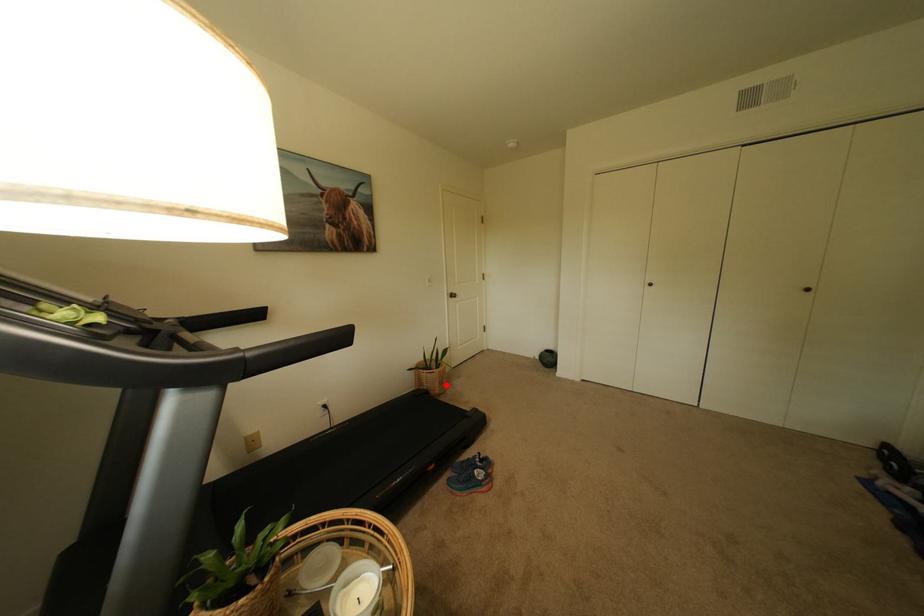
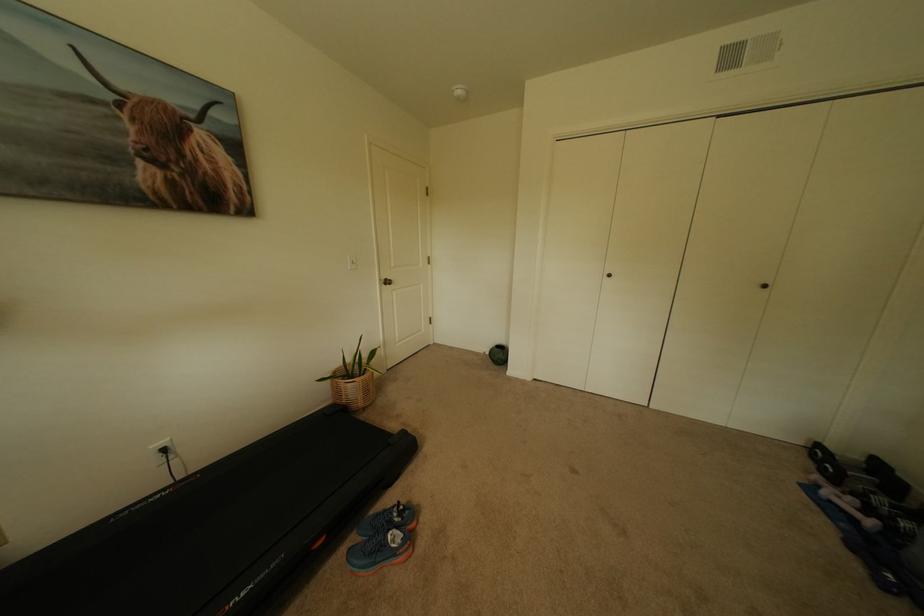
Question: I am providing you with two images of the same scene from different viewpoints. Image1 has a red point marked. In image2, the corresponding 3D location appears at what relative position? Reply with the corresponding letter.

Choices:
 (A) Closer
 (B) Farther

Answer: (A)